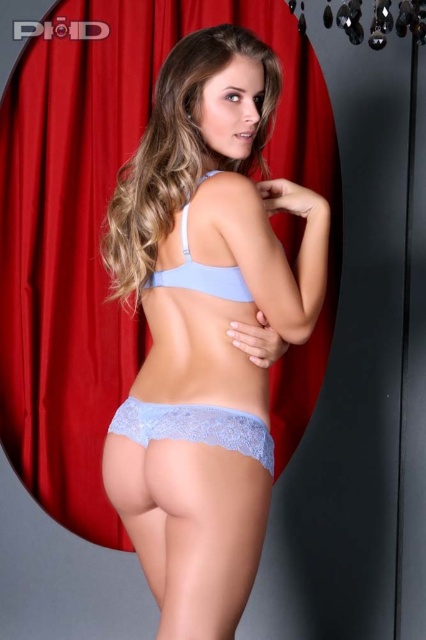
Based on the scene description, which object is taller between the light blue lace bra at center and the light blue lace bikini top at center?

The light blue lace bra at center is much taller than the light blue lace bikini top at center.

Consider the image. You are a photographer adjusting the camera focus. The subject is wearing a light blue lace bra at center and lacy blue underwear at lower center. Which piece of clothing should you focus on first if you want to ensure the closer item is sharp?

The light blue lace bra at center is closer to the viewer, so you should focus on the light blue lace bra at center first to ensure it is sharp.